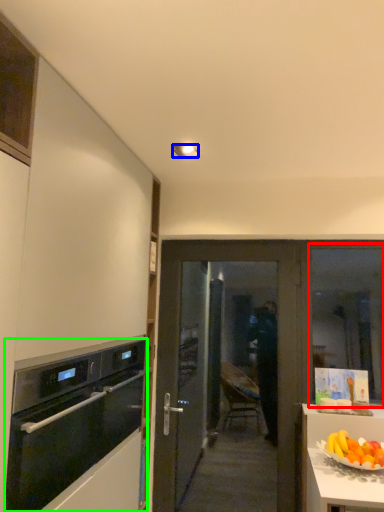
Question: Which is farther away from window (highlighted by a red box)? lamp (highlighted by a blue box) or kitchen appliance (highlighted by a green box)?

Choices:
 (A) lamp
 (B) kitchen appliance

Answer: (A)